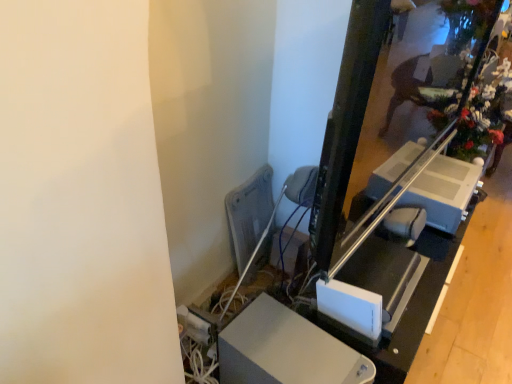
Question: Considering the positions of white plastic table at center and white plastic lift at right in the image, is white plastic table at center wider or thinner than white plastic lift at right?

Choices:
 (A) wide
 (B) thin

Answer: (A)

Question: In terms of height, does white plastic table at center look taller or shorter compared to white plastic lift at right?

Choices:
 (A) tall
 (B) short

Answer: (A)

Question: Which object is the closest to the gray metallic radiator at center?

Choices:
 (A) white plastic speaker at center
 (B) white plastic table at center
 (C) white plastic lift at right

Answer: (B)

Question: Estimate the real-world distances between objects in this image. Which object is closer to the gray metallic radiator at center?

Choices:
 (A) white plastic speaker at center
 (B) white plastic table at center
 (C) white plastic lift at right

Answer: (B)